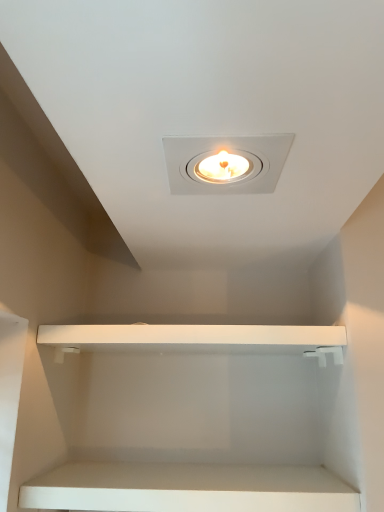
Question: Considering the relative sizes of white matte cabinet at lower center, which appears as the 2th cabinet when viewed from the top, and white matte shelf at center, which is the first cabinet from top to bottom, in the image provided, is white matte cabinet at lower center, which appears as the 2th cabinet when viewed from the top, wider than white matte shelf at center, which is the first cabinet from top to bottom,?

Choices:
 (A) no
 (B) yes

Answer: (A)

Question: Is white matte cabinet at lower center, which appears as the 2th cabinet when viewed from the top, not inside white matte shelf at center, which is the first cabinet from top to bottom?

Choices:
 (A) no
 (B) yes

Answer: (B)

Question: Could you tell me if white matte cabinet at lower center, which is the 1th cabinet from bottom to top, is facing white matte shelf at center, which ranks as the 2th cabinet in bottom-to-top order?

Choices:
 (A) yes
 (B) no

Answer: (B)

Question: Does white matte cabinet at lower center, which appears as the 2th cabinet when viewed from the top, have a smaller size compared to white matte shelf at center, which is the first cabinet from top to bottom?

Choices:
 (A) no
 (B) yes

Answer: (B)

Question: Does white matte cabinet at lower center, which is the 1th cabinet from bottom to top, have a lesser width compared to white matte shelf at center, which ranks as the 2th cabinet in bottom-to-top order?

Choices:
 (A) yes
 (B) no

Answer: (A)

Question: From the image's perspective, is white matte cabinet at lower center, which appears as the 2th cabinet when viewed from the top, above white matte shelf at center, which ranks as the 2th cabinet in bottom-to-top order?

Choices:
 (A) yes
 (B) no

Answer: (B)

Question: Is white matte shelf at center, which ranks as the 2th cabinet in bottom-to-top order, wider than white matte cabinet at lower center, which is the 1th cabinet from bottom to top?

Choices:
 (A) yes
 (B) no

Answer: (A)

Question: Is there a large distance between white matte shelf at center, which is the first cabinet from top to bottom, and white matte cabinet at lower center, which appears as the 2th cabinet when viewed from the top?

Choices:
 (A) yes
 (B) no

Answer: (B)

Question: Can you confirm if white matte shelf at center, which is the first cabinet from top to bottom, is smaller than white matte cabinet at lower center, which appears as the 2th cabinet when viewed from the top?

Choices:
 (A) yes
 (B) no

Answer: (B)

Question: From the image's perspective, is white matte shelf at center, which ranks as the 2th cabinet in bottom-to-top order, above white matte cabinet at lower center, which appears as the 2th cabinet when viewed from the top?

Choices:
 (A) no
 (B) yes

Answer: (B)

Question: Is white matte shelf at center, which is the first cabinet from top to bottom, beside white matte cabinet at lower center, which appears as the 2th cabinet when viewed from the top?

Choices:
 (A) yes
 (B) no

Answer: (B)

Question: Is white matte cabinet at lower center, which appears as the 2th cabinet when viewed from the top, inside white matte shelf at center, which ranks as the 2th cabinet in bottom-to-top order?

Choices:
 (A) no
 (B) yes

Answer: (A)

Question: Is white matte cabinet at lower center, which is the 1th cabinet from bottom to top, inside the boundaries of white matte shelf at center, which is the first cabinet from top to bottom, or outside?

Choices:
 (A) outside
 (B) inside

Answer: (A)